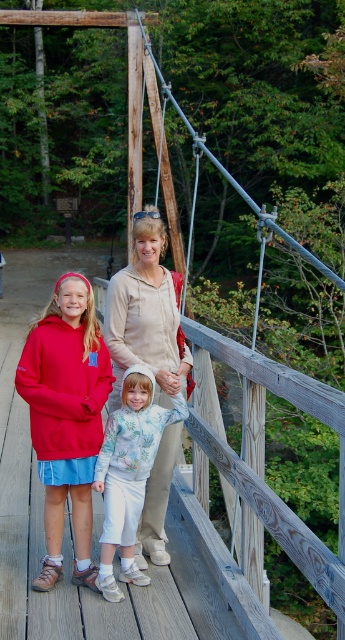
Is matte red hoodie at center below floral sweatshirt at center?

No, matte red hoodie at center is not below floral sweatshirt at center.

Can you confirm if matte red hoodie at center is shorter than floral sweatshirt at center?

No.

Describe the element at coordinates (65, 417) in the screenshot. I see `matte red hoodie at center` at that location.

Where is `matte red hoodie at center`? The height and width of the screenshot is (640, 345). matte red hoodie at center is located at coordinates (65, 417).

You are a GUI agent. You are given a task and a screenshot of the screen. Output one action in this format:
    pyautogui.click(x=<x>, y=<y>)
    Task: Click on the beige cotton hoodie at center
    Image resolution: width=345 pixels, height=640 pixels.
    Given the screenshot: What is the action you would take?
    pyautogui.click(x=146, y=316)

Can you confirm if beige cotton hoodie at center is smaller than floral sweatshirt at center?

Actually, beige cotton hoodie at center might be larger than floral sweatshirt at center.

At what (x,y) coordinates should I click in order to perform the action: click on beige cotton hoodie at center. Please return your answer as a coordinate pair (x, y). Looking at the image, I should click on (146, 316).

Who is more forward, [93,461] or [101,440]?

Point [93,461]

Does matte red hoodie at left have a greater width compared to matte red hoodie at center?

Indeed, matte red hoodie at left has a greater width compared to matte red hoodie at center.

Measure the distance between matte red hoodie at left and camera.

The distance of matte red hoodie at left from camera is 4.26 meters.

Image resolution: width=345 pixels, height=640 pixels. Identify the location of matte red hoodie at left. (65, 416).